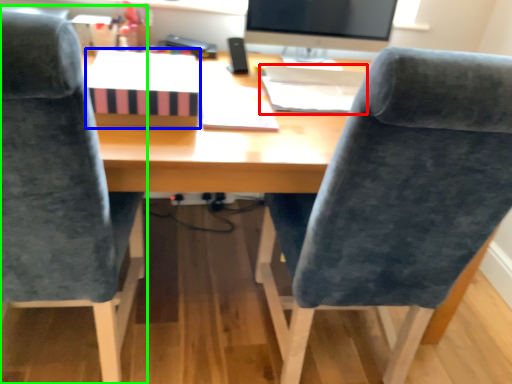
Question: Considering the real-world distances, which object is farthest from book (highlighted by a red box)? book (highlighted by a blue box) or chair (highlighted by a green box)?

Choices:
 (A) book
 (B) chair

Answer: (B)